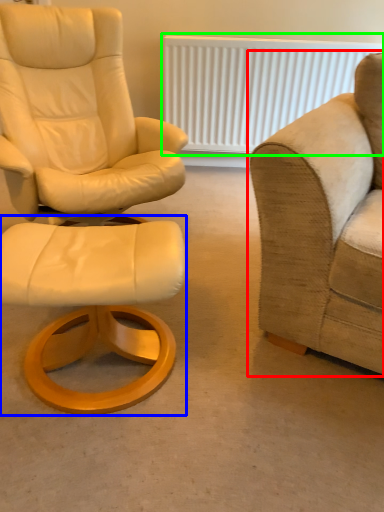
Question: Which is farther away from studio couch (highlighted by a red box)? stool (highlighted by a blue box) or radiator (highlighted by a green box)?

Choices:
 (A) stool
 (B) radiator

Answer: (B)